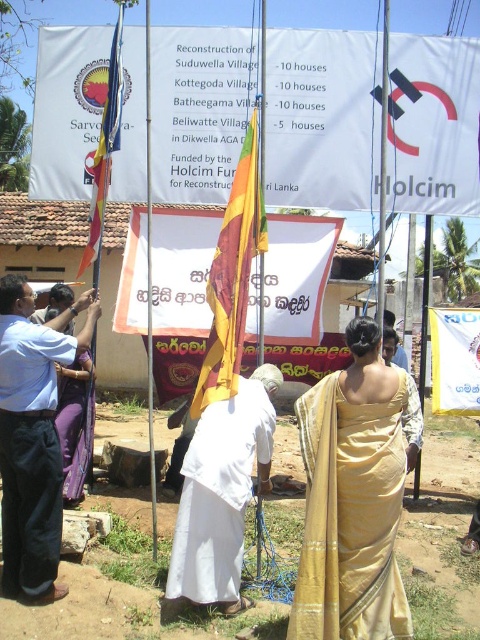
Looking at this image, you are a photographer trying to capture the flag raising ceremony. You need to position yourself so that the gold silk saree at center is in the center of your photo. What coordinates should you aim for?

The gold silk saree at center is located at coordinates point (x=352, y=497), so you should aim for those coordinates to center it in your photo.